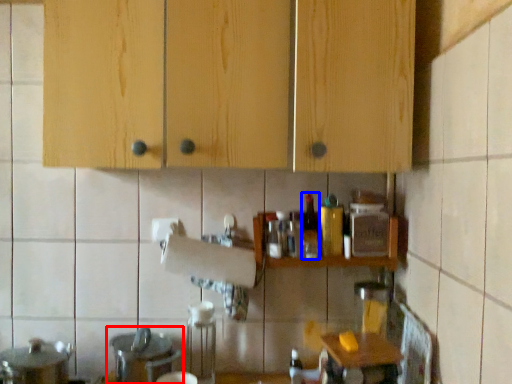
Question: Among these objects, which one is nearest to the camera, sink (highlighted by a red box) or bottle (highlighted by a blue box)?

Choices:
 (A) sink
 (B) bottle

Answer: (A)